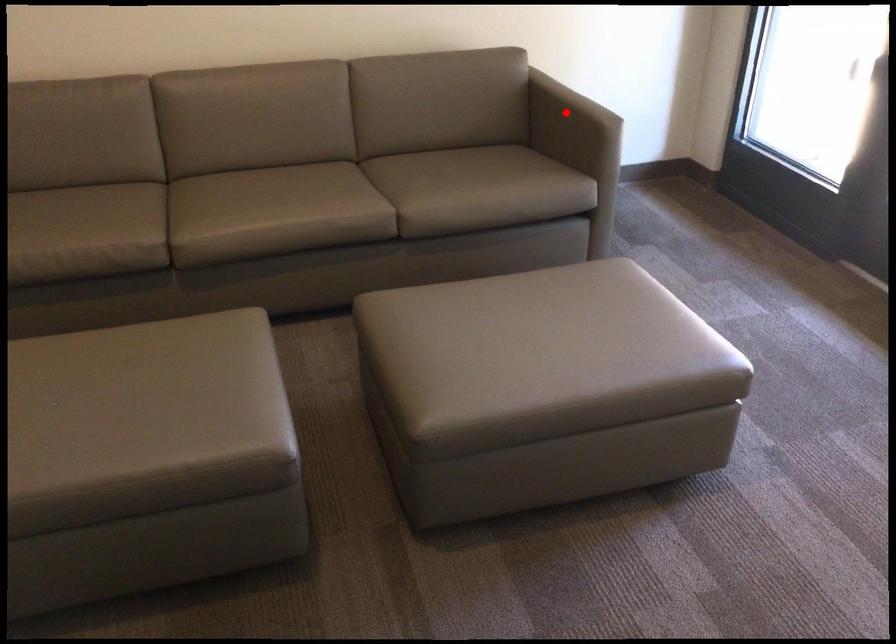
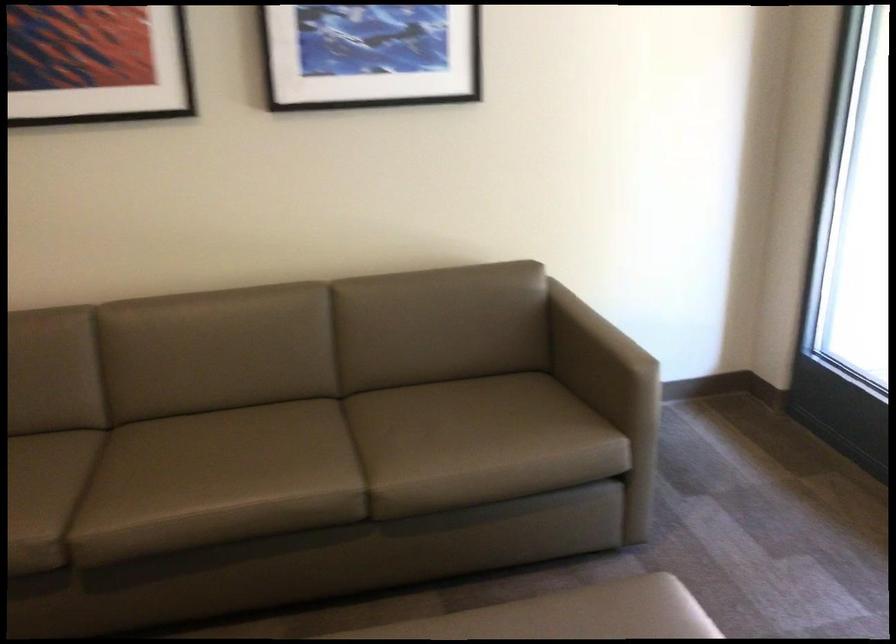
Question: I am providing you with two images of the same scene from different viewpoints. In image1, a red point is highlighted. Considering the same 3D point in image2, which of the following is correct?

Choices:
 (A) It is closer
 (B) It is farther

Answer: (A)